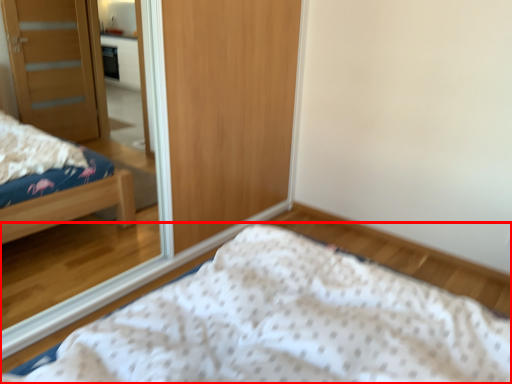
Question: Considering the relative positions of bed (annotated by the red box) and mirror in the image provided, where is bed (annotated by the red box) located with respect to the staircase?

Choices:
 (A) right
 (B) left

Answer: (A)